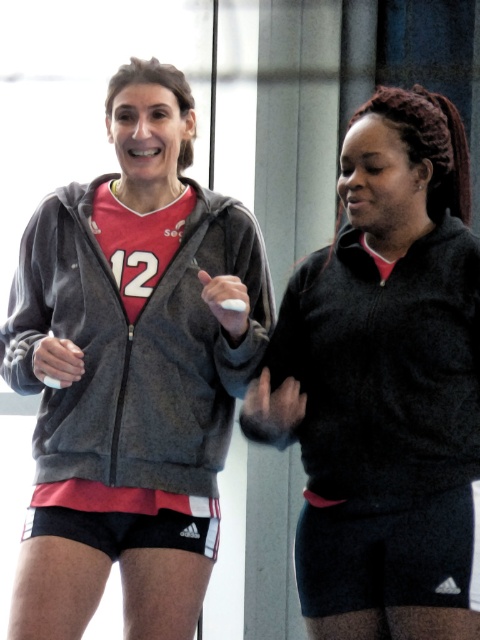
You are a photographer trying to capture a candid shot of the two people in the scene. You notice that the charcoal fleece sweatshirt at left is at point (135, 346). Where should you position your camera to ensure both subjects are in frame?

Position your camera so that it captures the area around point (135, 346) where the charcoal fleece sweatshirt at left is located, ensuring both subjects are within the frame.